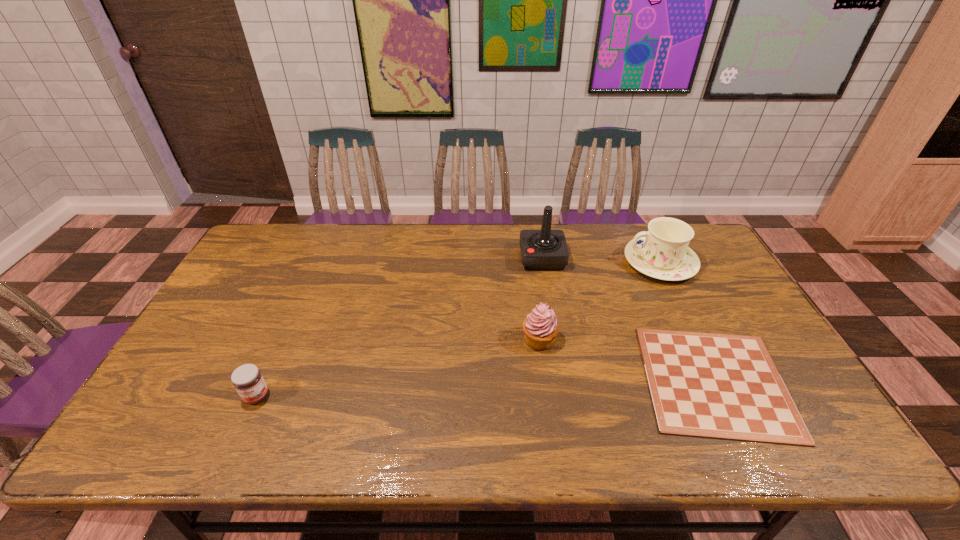
You are a GUI agent. You are given a task and a screenshot of the screen. Output one action in this format:
    pyautogui.click(x=<x>, y=<y>)
    Task: Click on the vacant area that lies between the chinaware and the leftmost object
    
    Given the screenshot: What is the action you would take?
    pyautogui.click(x=458, y=329)

Locate an element on the screen. This screenshot has height=540, width=960. free point between the leftmost object and the checkerboard is located at coordinates (486, 389).

You are a GUI agent. You are given a task and a screenshot of the screen. Output one action in this format:
    pyautogui.click(x=<x>, y=<y>)
    Task: Click on the free space that is in between the joystick and the cupcake
    Image resolution: width=960 pixels, height=540 pixels.
    Given the screenshot: What is the action you would take?
    pyautogui.click(x=540, y=299)

The width and height of the screenshot is (960, 540). I want to click on free space between the joystick and the cupcake, so click(x=540, y=299).

At what (x,y) coordinates should I click in order to perform the action: click on free area in between the leftmost object and the cupcake. Please return your answer as a coordinate pair (x, y). The image size is (960, 540). Looking at the image, I should click on coord(397,368).

The image size is (960, 540). What are the coordinates of `blank region between the joystick and the chinaware` in the screenshot? It's located at (601, 260).

At what (x,y) coordinates should I click in order to perform the action: click on empty space that is in between the shortest object and the joystick. Please return your answer as a coordinate pair (x, y). The width and height of the screenshot is (960, 540). Looking at the image, I should click on (629, 320).

The height and width of the screenshot is (540, 960). What are the coordinates of `empty space that is in between the tallest object and the checkerboard` in the screenshot? It's located at (629, 320).

Find the location of a particular element. The image size is (960, 540). object that is the fourth nearest to the cupcake is located at coordinates (247, 379).

Point out which object is positioned as the fourth nearest to the shortest object. Please provide its 2D coordinates. Your answer should be formatted as a tuple, i.e. [(x, y)], where the tuple contains the x and y coordinates of a point satisfying the conditions above.

[(247, 379)]